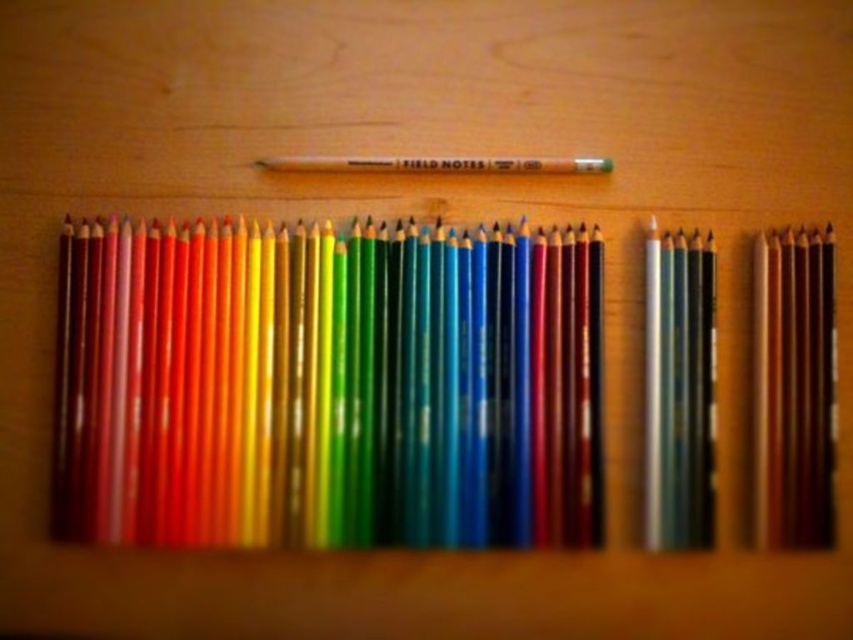
Based on the scene description, where is the matte wooden pencils at center located in terms of coordinates?

The matte wooden pencils at center are located at point coordinates of (x=328, y=385).

From the picture: What is located at the point marked by the coordinates (328, 385)?

The point marked by the coordinates (328, 385) is located at the matte wooden pencils at center.